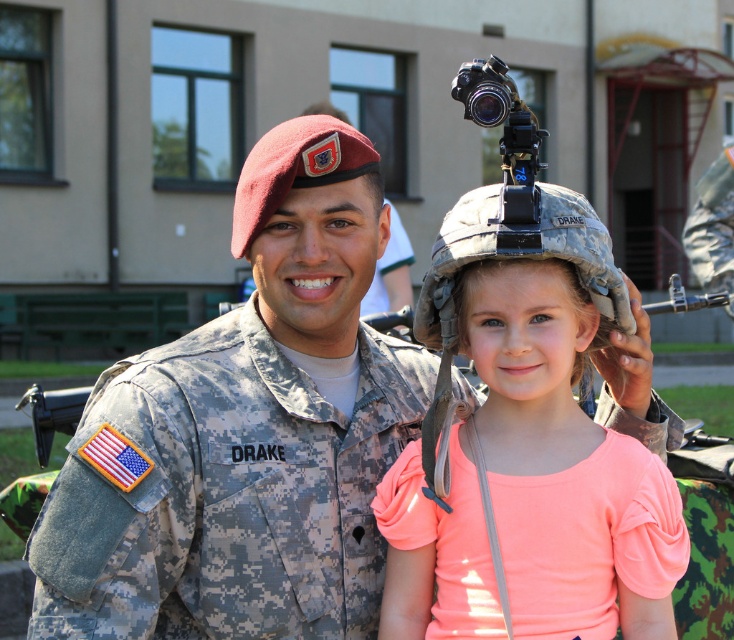
Question: Considering the relative positions of camouflage fabric uniform at center and camouflage helmet at center in the image provided, where is camouflage fabric uniform at center located with respect to camouflage helmet at center?

Choices:
 (A) below
 (B) above

Answer: (A)

Question: Which object is the closest to the camouflage fabric uniform at center?

Choices:
 (A) camouflage helmet at center
 (B) black matte video camera at upper center

Answer: (A)

Question: Which point is farther to the camera?

Choices:
 (A) camouflage helmet at center
 (B) black matte video camera at upper center
 (C) camouflage uniform at center

Answer: (C)

Question: Does camouflage uniform at center lie behind camouflage fabric uniform at center?

Choices:
 (A) yes
 (B) no

Answer: (A)

Question: Which point appears farthest from the camera in this image?

Choices:
 (A) (360, 493)
 (B) (501, 205)

Answer: (A)

Question: Does camouflage fabric uniform at center have a lesser width compared to black matte video camera at upper center?

Choices:
 (A) yes
 (B) no

Answer: (A)